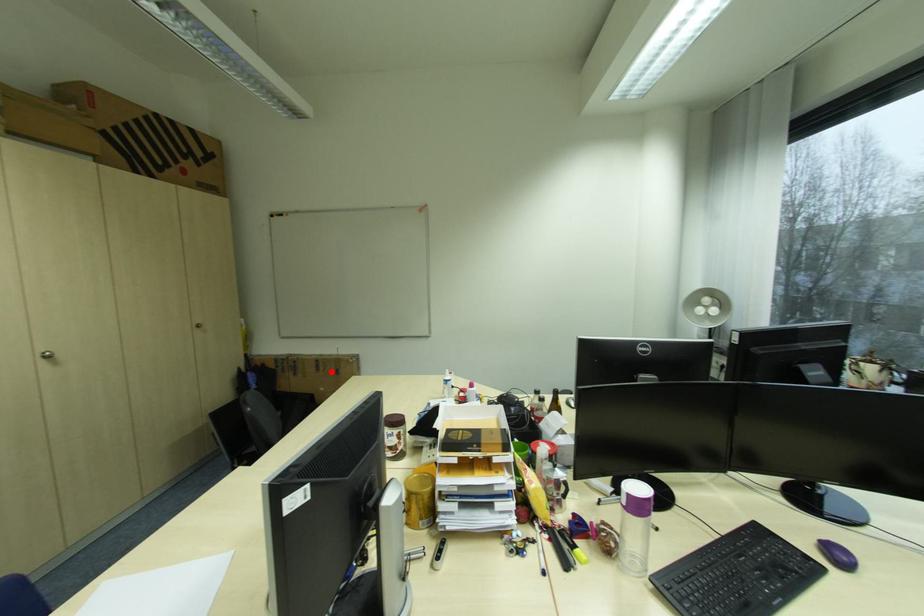
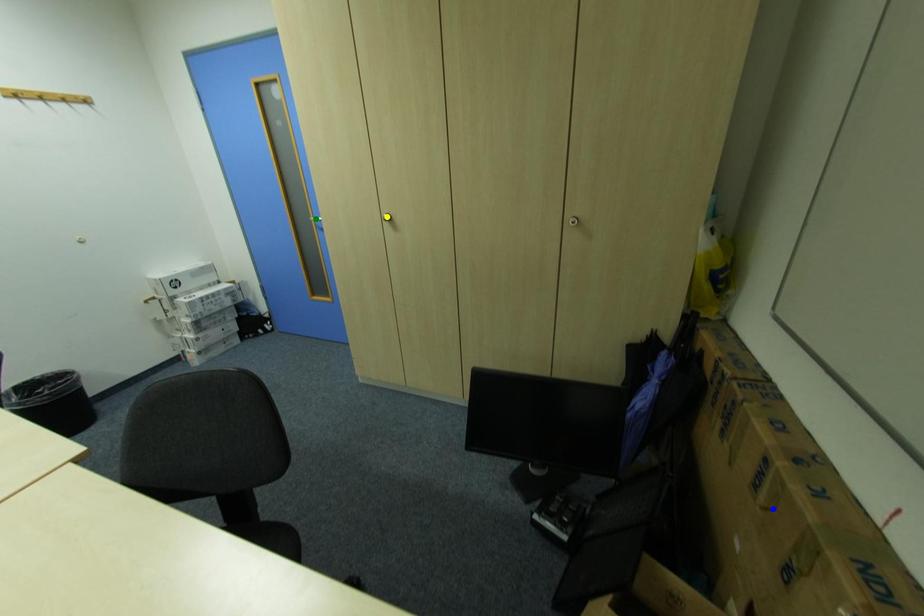
Question: I am providing you with two images of the same scene from different viewpoints. A red point is marked on the first image. You are given multiple points on the second image. Which mark in image 2 goes with the point in image 1?

Choices:
 (A) yellow point
 (B) blue point
 (C) green point

Answer: (B)